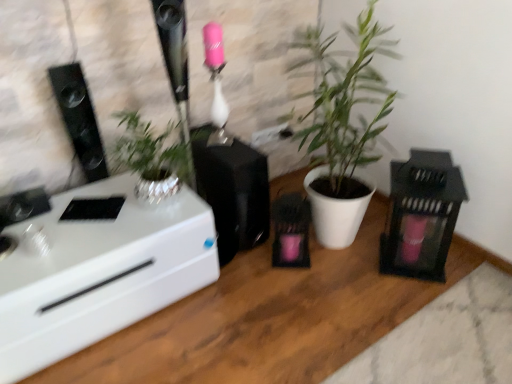
Image resolution: width=512 pixels, height=384 pixels. I want to click on vacant area located to the right-hand side of black matte lantern at right, arranged as the first appliance when viewed from the right, so click(474, 273).